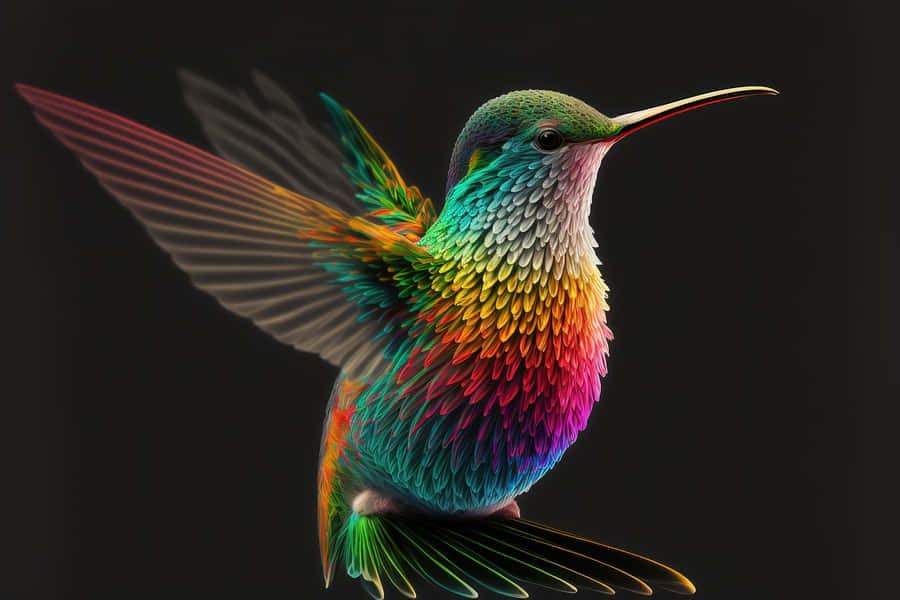
Locate an element on the screen. The width and height of the screenshot is (900, 600). the chest is located at coordinates (544, 301).